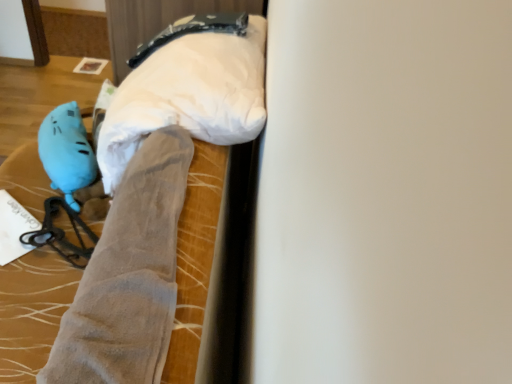
Question: Considering the positions of blue rubber glove at lower left and matte blue plush at left in the image, is blue rubber glove at lower left bigger or smaller than matte blue plush at left?

Choices:
 (A) big
 (B) small

Answer: (B)

Question: Considering the positions of blue rubber glove at lower left and matte blue plush at left in the image, is blue rubber glove at lower left taller or shorter than matte blue plush at left?

Choices:
 (A) tall
 (B) short

Answer: (B)

Question: Which object is the closest to the blue rubber glove at lower left?

Choices:
 (A) velvet-like gray blanket at center
 (B) white fabric pillow at upper center
 (C) suede-like gray legging at center-left
 (D) matte blue plush at left

Answer: (A)

Question: Which object is the closest to the blue rubber glove at lower left?

Choices:
 (A) suede-like gray legging at center-left
 (B) matte blue plush at left
 (C) white fabric pillow at upper center
 (D) velvet-like gray blanket at center

Answer: (D)